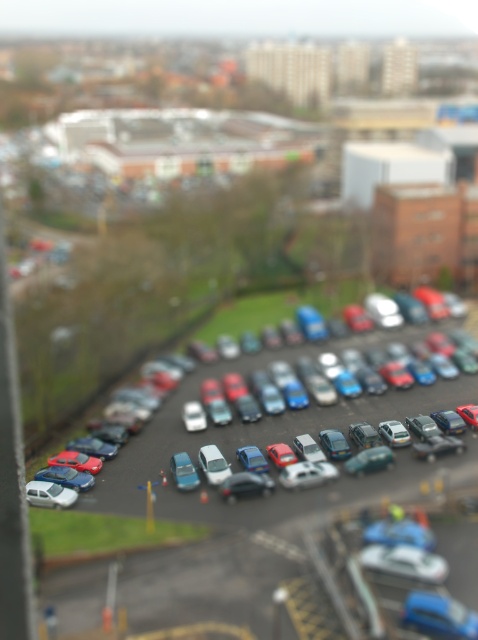
Question: Which object is farther from the camera taking this photo?

Choices:
 (A) matte silver car at center
 (B) metallic silver cars at center

Answer: (A)

Question: Among these points, which one is nearest to the camera?

Choices:
 (A) (474, 412)
 (B) (177, 454)
 (C) (210, 449)
 (D) (75, 595)

Answer: (D)

Question: In this image, where is metallic silver cars at center located relative to matte silver car at center?

Choices:
 (A) above
 (B) below

Answer: (A)

Question: Is metallic silver cars at center bigger than matte silver car at center?

Choices:
 (A) no
 (B) yes

Answer: (B)

Question: Which point appears farthest from the camera in this image?

Choices:
 (A) [315, 428]
 (B) [173, 470]

Answer: (A)

Question: Does matte silver car at center appear over metallic silver car at center?

Choices:
 (A) no
 (B) yes

Answer: (B)